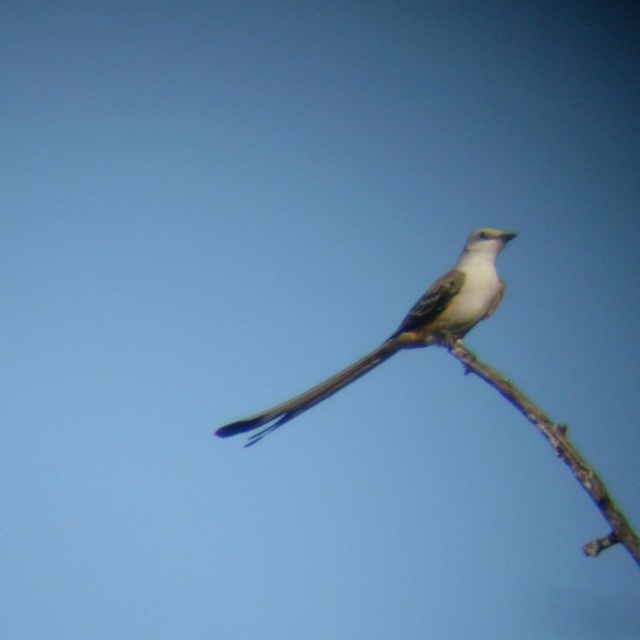
Question: Can you confirm if white matte bird at center is smaller than silvery metallic tail at center?

Choices:
 (A) no
 (B) yes

Answer: (A)

Question: Which object appears farthest from the camera in this image?

Choices:
 (A) silvery metallic tail at center
 (B) brown rough tree branch at right

Answer: (A)

Question: Observing the image, what is the correct spatial positioning of white matte bird at center in reference to brown rough tree branch at right?

Choices:
 (A) above
 (B) below

Answer: (A)

Question: Estimate the real-world distances between objects in this image. Which object is farther from the brown rough tree branch at right?

Choices:
 (A) white matte bird at center
 (B) silvery metallic tail at center

Answer: (B)

Question: Which of the following is the closest to the observer?

Choices:
 (A) (378, 355)
 (B) (436, 339)
 (C) (621, 544)

Answer: (C)

Question: Is white matte bird at center below silvery metallic tail at center?

Choices:
 (A) no
 (B) yes

Answer: (A)